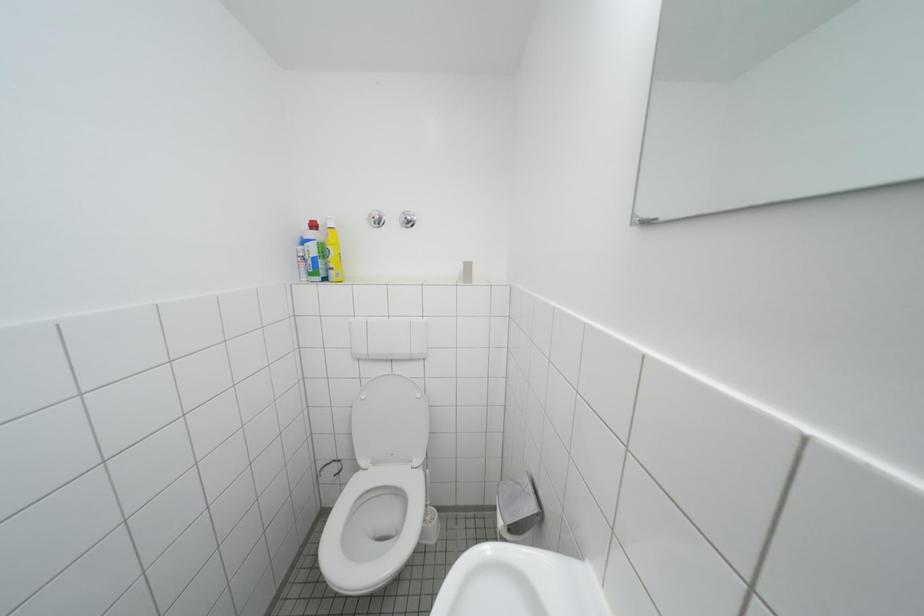
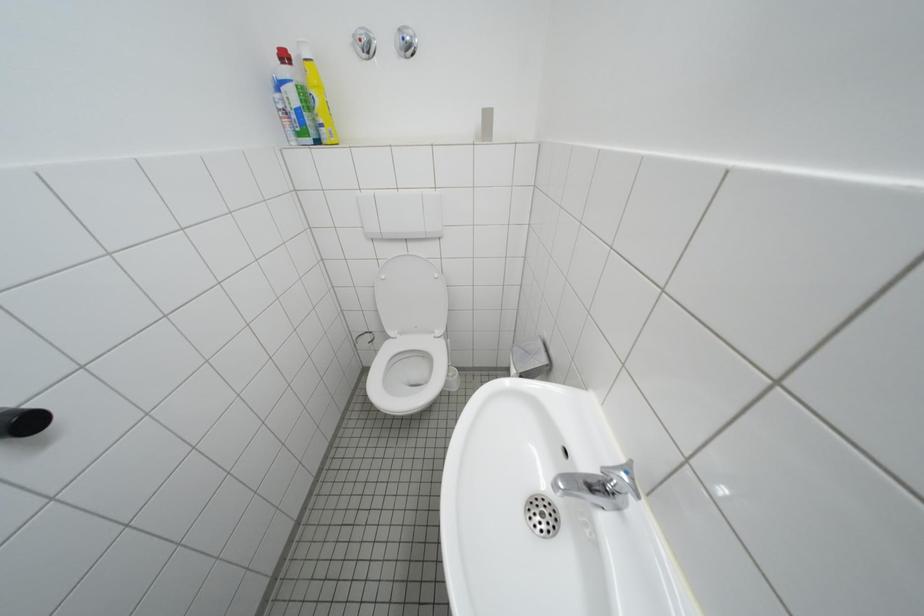
Question: The images are taken continuously from a first-person perspective. In which direction is your viewpoint rotating?

Choices:
 (A) Left
 (B) Right
 (C) Up
 (D) Down

Answer: (D)